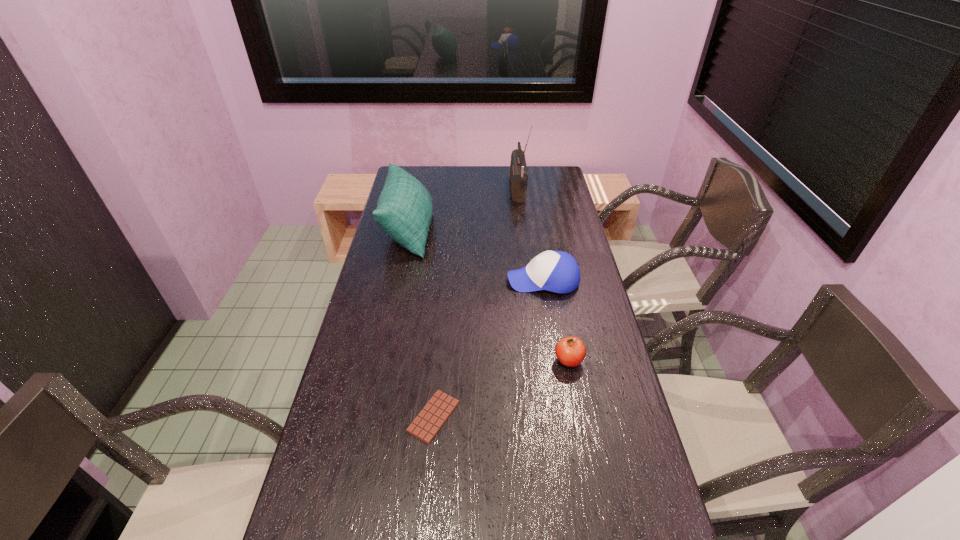
Locate an element on the screen. This screenshot has width=960, height=540. vacant space situated on the front-facing side of the radio receiver is located at coordinates (460, 190).

I want to click on vacant region located on the front-facing side of the cushion, so click(x=510, y=231).

This screenshot has width=960, height=540. Find the location of `vacant space situated 0.130m on the left of the fourth farthest object`. vacant space situated 0.130m on the left of the fourth farthest object is located at coordinates (508, 361).

The image size is (960, 540). I want to click on free space located 0.220m on the front-facing side of the baseball cap, so click(x=444, y=280).

Where is `vacant space situated 0.130m on the front-facing side of the baseball cap`? Image resolution: width=960 pixels, height=540 pixels. vacant space situated 0.130m on the front-facing side of the baseball cap is located at coordinates (469, 280).

I want to click on free region located 0.130m on the front-facing side of the baseball cap, so click(469, 280).

You are a GUI agent. You are given a task and a screenshot of the screen. Output one action in this format:
    pyautogui.click(x=<x>, y=<y>)
    Task: Click on the free region located on the right of the shortest object
    Image resolution: width=960 pixels, height=540 pixels.
    Given the screenshot: What is the action you would take?
    pyautogui.click(x=593, y=416)

Find the location of `object present at the far edge`. object present at the far edge is located at coordinates (518, 169).

The width and height of the screenshot is (960, 540). Identify the location of object present at the left edge. (404, 210).

Locate an element on the screen. apple at the right edge is located at coordinates (570, 351).